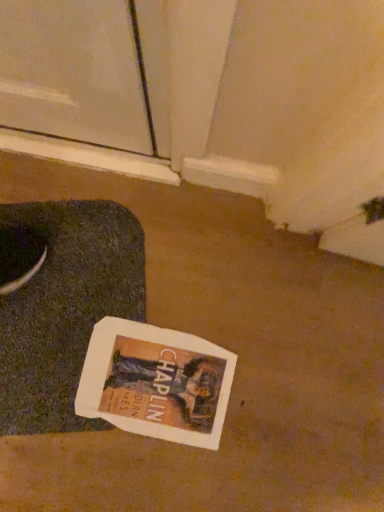
Where is `vacant area on the back side of white paper magazine at center`? Image resolution: width=384 pixels, height=512 pixels. vacant area on the back side of white paper magazine at center is located at coordinates (193, 278).